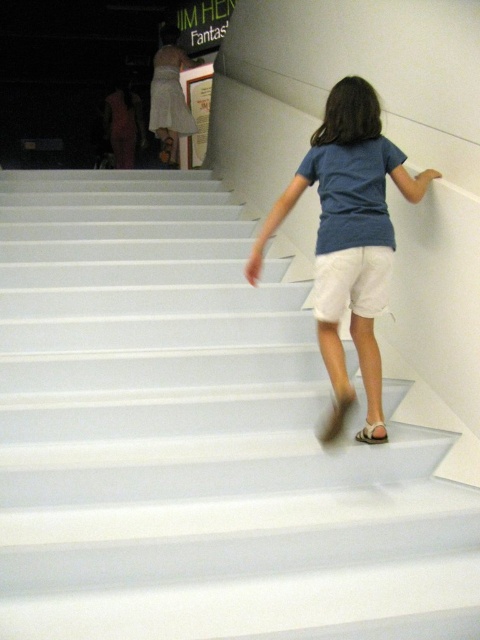
You are an architect designing a museum. You need to ensure that the white cotton shorts at center of visitors can be seen from the top of the white glossy stairs at center. Based on their positions, is this possible?

The white glossy stairs at center is below the white cotton shorts at center, so yes, the white cotton shorts at center can be seen from the top of the white glossy stairs at center because the shorts are positioned above the stairs.

You are a photographer trying to capture the child in the scene. Since the blue cotton shirt at center and the white fabric sandal at lower center are both in view, which object will appear larger in your photo?

The blue cotton shirt at center will appear larger in the photo because it has a greater height compared to the white fabric sandal at lower center.